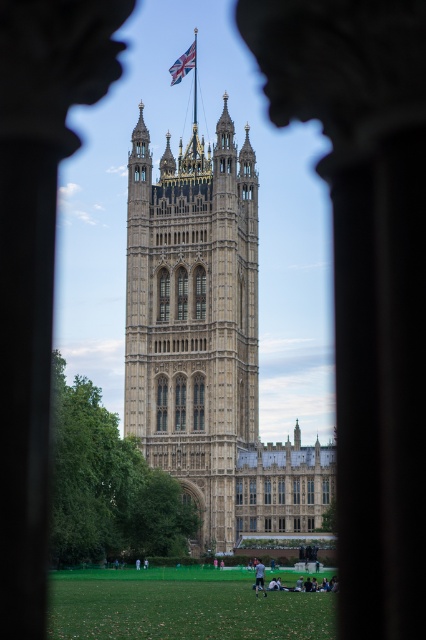
Question: Does beige stone tower at center have a lesser width compared to union jack fabric at upper center?

Choices:
 (A) yes
 (B) no

Answer: (B)

Question: Can you confirm if beige stone tower at center is positioned to the right of union jack fabric at upper center?

Choices:
 (A) yes
 (B) no

Answer: (A)

Question: From the image, what is the correct spatial relationship of beige stone tower at center in relation to union jack fabric at upper center?

Choices:
 (A) above
 (B) below

Answer: (B)